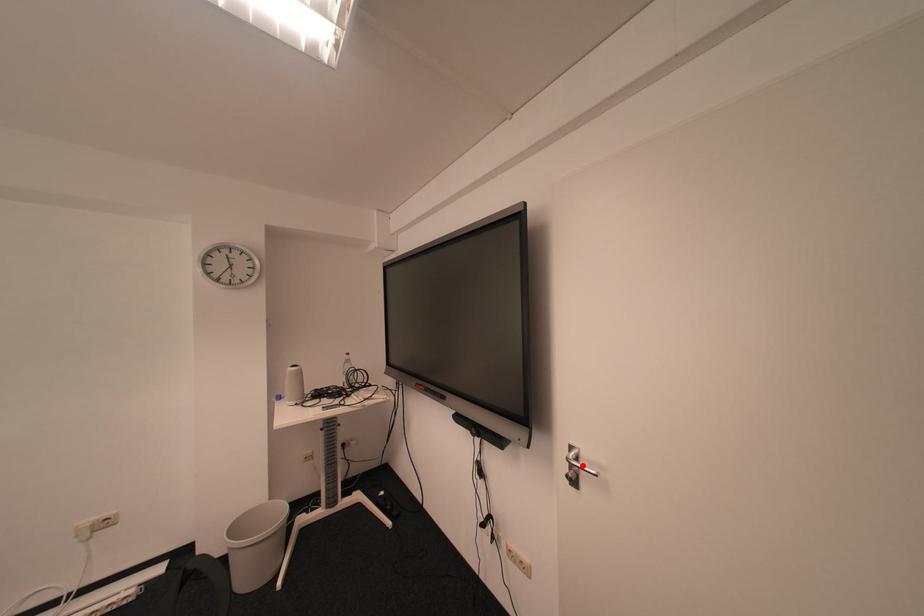
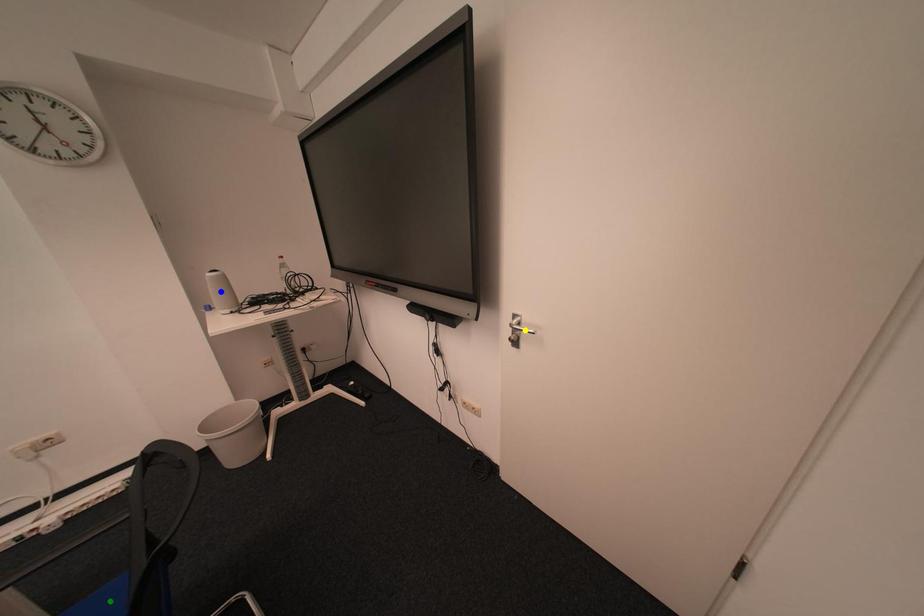
Question: I am providing you with two images of the same scene from different viewpoints. A red point is marked on the first image. You are given multiple points on the second image. Which mark in image 2 goes with the point in image 1?

Choices:
 (A) green point
 (B) blue point
 (C) yellow point

Answer: (C)